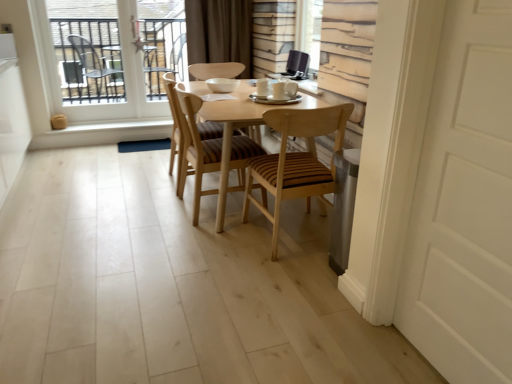
At what (x,y) coordinates should I click in order to perform the action: click on free space in front of wooden table at center. Please return your answer as a coordinate pair (x, y). Looking at the image, I should click on (178, 273).